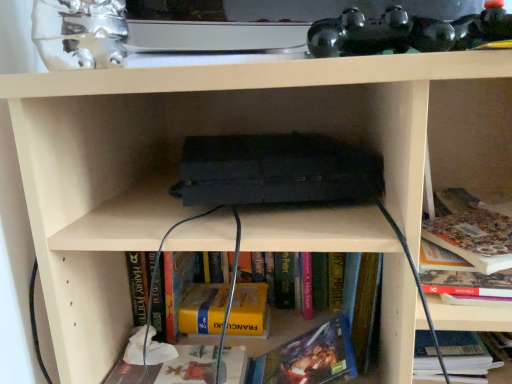
Question: Is hardcover book at lower right, which is counted as the first book, starting from the right, oriented away from matte paper book at lower center, which ranks as the first book in left-to-right order?

Choices:
 (A) yes
 (B) no

Answer: (B)

Question: Would you say hardcover book at lower right, which is counted as the fourth book, starting from the left, contains matte paper book at lower center, which is counted as the 4th book, starting from the right?

Choices:
 (A) yes
 (B) no

Answer: (B)

Question: From the image's perspective, would you say hardcover book at lower right, which is counted as the fourth book, starting from the left, is shown under matte paper book at lower center, which ranks as the first book in left-to-right order?

Choices:
 (A) yes
 (B) no

Answer: (B)

Question: Considering the relative sizes of hardcover book at lower right, which is counted as the fourth book, starting from the left, and matte paper book at lower center, which is counted as the 4th book, starting from the right, in the image provided, is hardcover book at lower right, which is counted as the fourth book, starting from the left, thinner than matte paper book at lower center, which is counted as the 4th book, starting from the right,?

Choices:
 (A) yes
 (B) no

Answer: (B)

Question: Considering the relative sizes of hardcover book at lower right, which is counted as the fourth book, starting from the left, and matte paper book at lower center, which is counted as the 4th book, starting from the right, in the image provided, is hardcover book at lower right, which is counted as the fourth book, starting from the left, taller than matte paper book at lower center, which is counted as the 4th book, starting from the right,?

Choices:
 (A) no
 (B) yes

Answer: (B)

Question: From the image's perspective, is hardcover book at lower center, the 3th book positioned from the left, located above or below yellow matte book at center, which is the 2th book in left-to-right order?

Choices:
 (A) below
 (B) above

Answer: (A)

Question: Would you say hardcover book at lower center, the 3th book positioned from the left, is to the left or to the right of yellow matte book at center, which is the 2th book in left-to-right order, in the picture?

Choices:
 (A) left
 (B) right

Answer: (B)

Question: Looking at their shapes, would you say hardcover book at lower center, positioned as the 2th book in right-to-left order, is wider or thinner than yellow matte book at center, which is the 2th book in left-to-right order?

Choices:
 (A) wide
 (B) thin

Answer: (A)

Question: In terms of height, does hardcover book at lower center, positioned as the 2th book in right-to-left order, look taller or shorter compared to yellow matte book at center, which is the 2th book in left-to-right order?

Choices:
 (A) tall
 (B) short

Answer: (A)

Question: Is hardcover book at lower center, the 3th book positioned from the left, taller or shorter than hardcover book at lower right, which is counted as the fourth book, starting from the left?

Choices:
 (A) short
 (B) tall

Answer: (B)

Question: Considering their positions, is hardcover book at lower center, positioned as the 2th book in right-to-left order, located in front of or behind hardcover book at lower right, which is counted as the fourth book, starting from the left?

Choices:
 (A) behind
 (B) front

Answer: (A)

Question: Is hardcover book at lower center, positioned as the 2th book in right-to-left order, inside the boundaries of hardcover book at lower right, which is counted as the fourth book, starting from the left, or outside?

Choices:
 (A) inside
 (B) outside

Answer: (B)

Question: Visually, is hardcover book at lower center, the 3th book positioned from the left, positioned to the left or to the right of hardcover book at lower right, which is counted as the first book, starting from the right?

Choices:
 (A) right
 (B) left

Answer: (B)

Question: In terms of width, does hardcover book at lower center, the 3th book positioned from the left, look wider or thinner when compared to matte paper book at lower center, which is counted as the 4th book, starting from the right?

Choices:
 (A) wide
 (B) thin

Answer: (B)

Question: In terms of size, does hardcover book at lower center, the 3th book positioned from the left, appear bigger or smaller than matte paper book at lower center, which is counted as the 4th book, starting from the right?

Choices:
 (A) big
 (B) small

Answer: (A)